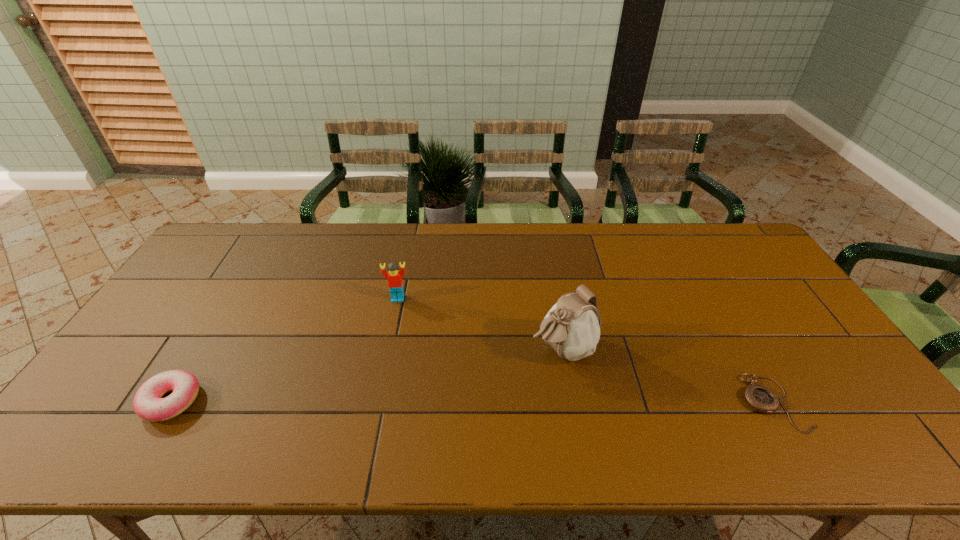
I want to click on free location located 0.270m on the front-facing side of the second object from right to left, so click(x=448, y=410).

Identify the location of vacant space situated on the front-facing side of the second object from right to left. (518, 371).

Image resolution: width=960 pixels, height=540 pixels. I want to click on free location located on the front-facing side of the second object from right to left, so click(x=476, y=395).

I want to click on vacant space located 0.250m on the face of the farthest object, so click(x=395, y=369).

The width and height of the screenshot is (960, 540). What are the coordinates of `blank space located on the face of the farthest object` in the screenshot? It's located at (397, 319).

This screenshot has width=960, height=540. In order to click on free location located 0.380m on the face of the farthest object in this screenshot , I will do `click(393, 413)`.

Image resolution: width=960 pixels, height=540 pixels. Identify the location of doughnut present at the near edge. (148, 405).

Find the location of a particular element. pocket watch located in the near edge section of the desktop is located at coordinates (760, 398).

The width and height of the screenshot is (960, 540). Find the location of `object that is at the left edge`. object that is at the left edge is located at coordinates (148, 405).

Identify the location of object situated at the near left corner. This screenshot has width=960, height=540. (148, 405).